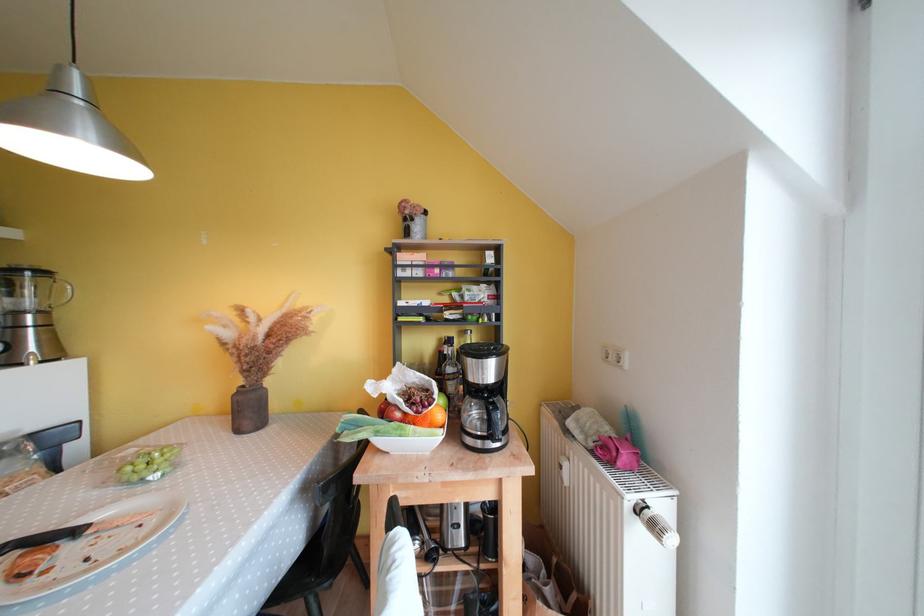
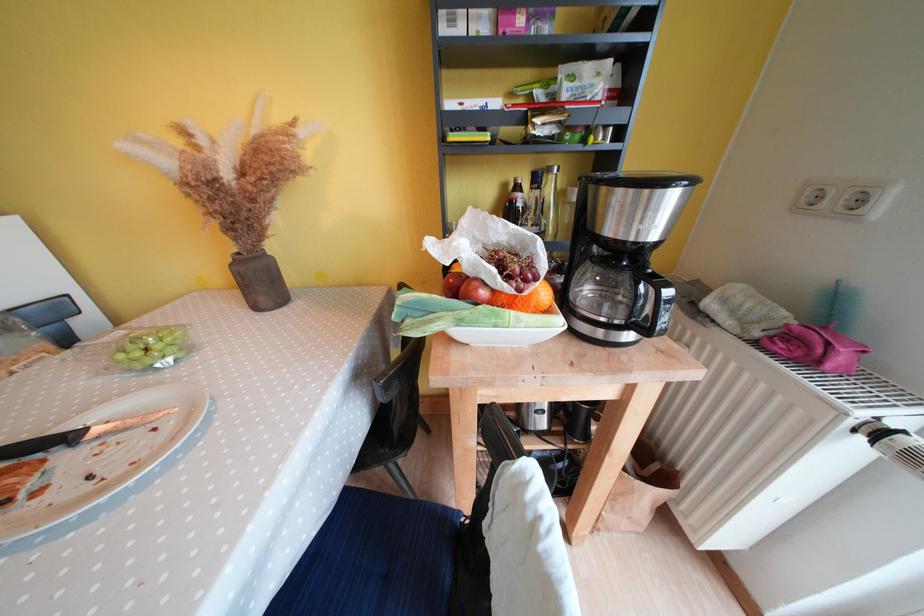
Question: Based on the continuous images, in which direction is the camera rotating? Reply with the corresponding letter.

Choices:
 (A) Left
 (B) Right
 (C) Up
 (D) Down

Answer: (D)